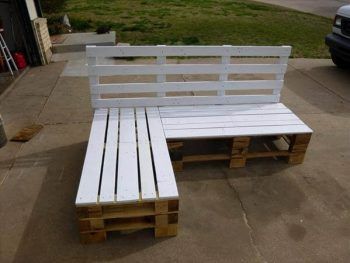
Locate an element on the screen. The image size is (350, 263). unpainted wood is located at coordinates (159, 207).